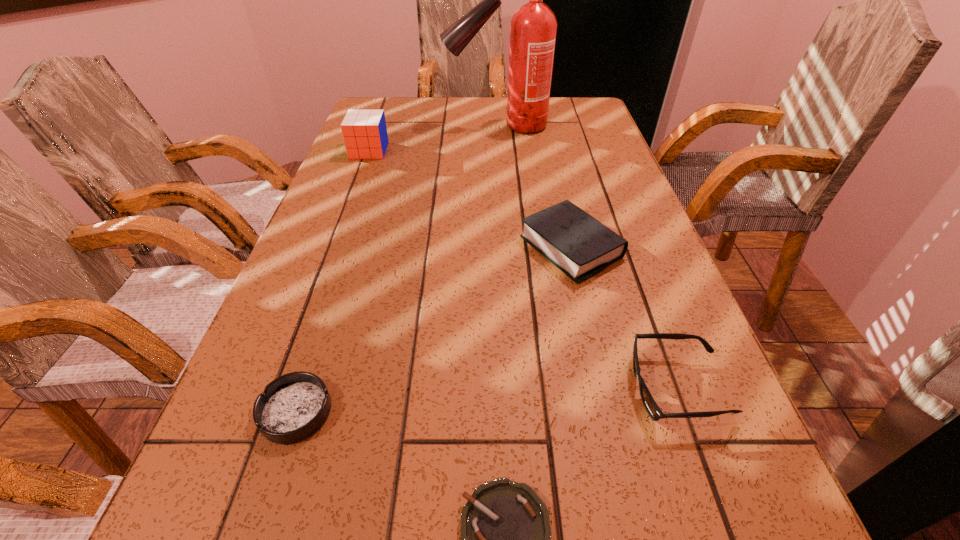
Image resolution: width=960 pixels, height=540 pixels. Find the location of `free space located 0.090m at the nozzle end of the farthest object`. free space located 0.090m at the nozzle end of the farthest object is located at coordinates (417, 126).

Locate an element on the screen. The image size is (960, 540). free space located 0.120m on the back of the second tallest object is located at coordinates pyautogui.click(x=378, y=125).

You are a GUI agent. You are given a task and a screenshot of the screen. Output one action in this format:
    pyautogui.click(x=<x>, y=<y>)
    Task: Click on the vacant point located on the back of the third farthest object
    This screenshot has height=540, width=960.
    Given the screenshot: What is the action you would take?
    pyautogui.click(x=551, y=160)

Find the location of a particular element. Image resolution: width=960 pixels, height=540 pixels. vacant space located 0.310m on the front-facing side of the sunglasses is located at coordinates (444, 388).

What are the coordinates of `free location located 0.130m on the front-facing side of the sunglasses` in the screenshot? It's located at (553, 388).

The width and height of the screenshot is (960, 540). What are the coordinates of `free space located on the front-facing side of the sunglasses` in the screenshot? It's located at (468, 388).

The image size is (960, 540). Find the location of `vacant space located 0.230m on the right of the taller ashtray`. vacant space located 0.230m on the right of the taller ashtray is located at coordinates (476, 412).

Image resolution: width=960 pixels, height=540 pixels. What are the coordinates of `object located in the far edge section of the desktop` in the screenshot? It's located at (533, 28).

Find the location of a particular element. cube at the left edge is located at coordinates (365, 136).

Locate an element on the screen. This screenshot has width=960, height=540. ashtray located at the left edge is located at coordinates (294, 406).